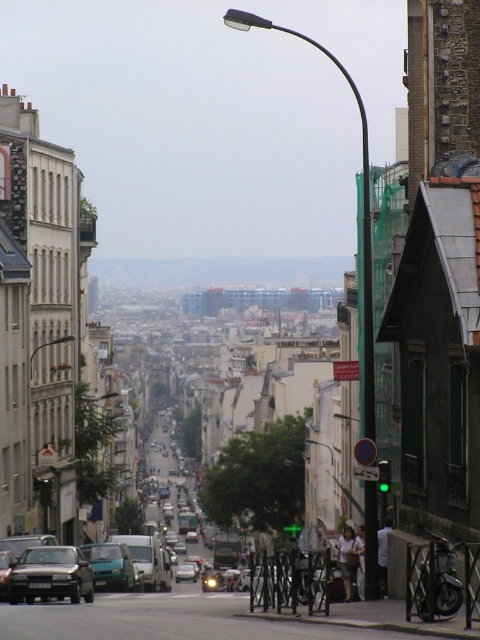
You are a delivery driver trying to navigate through the street. You see the black matte car at center and the teal matte van at center. Which vehicle is blocking the other one?

The black matte car at center is positioned over the teal matte van at center, so it is blocking the teal matte van at center.

You are a delivery driver who needs to park your vehicle between the teal matte van at center and the silver metallic car at center. The parking space between them is exactly 200 feet long. Can you safely park your 18.5 feet long delivery van there?

The parking space between the teal matte van at center and the silver metallic car at center is 217.74 feet long. Since your delivery van is only 18.5 feet long, there is more than enough space to park safely.

You are a delivery driver who needs to park your vehicle at the teal matte van at center. The parking spot is marked by the point at coordinates point (110, 566). Considering the slope of the road, will the parking spot be uphill or downhill from your current position at the bottom of the slope?

The parking spot at point (110, 566) is uphill from your current position at the bottom of the slope because the image shows a sloping road leading upwards towards the center where the teal matte van is located.